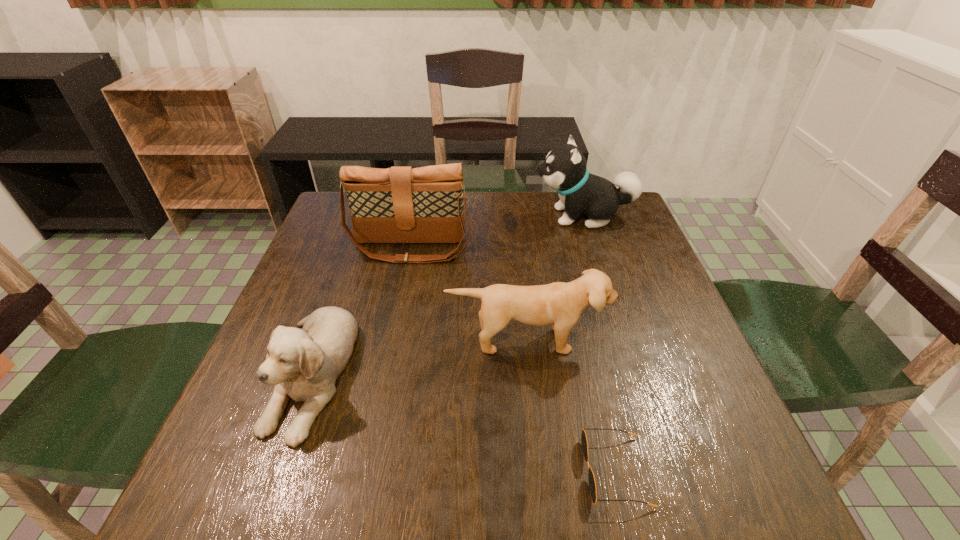
This screenshot has height=540, width=960. Identify the location of the farthest puppy. (565, 170).

This screenshot has height=540, width=960. I want to click on the tallest puppy, so click(565, 170).

You are a GUI agent. You are given a task and a screenshot of the screen. Output one action in this format:
    pyautogui.click(x=<x>, y=<y>)
    Task: Click on the shoulder bag
    
    Given the screenshot: What is the action you would take?
    pyautogui.click(x=401, y=204)

Identify the location of the leftmost puppy. The height and width of the screenshot is (540, 960). (303, 364).

This screenshot has width=960, height=540. I want to click on sunglasses, so click(x=592, y=485).

You are a GUI agent. You are given a task and a screenshot of the screen. Output one action in this format:
    pyautogui.click(x=<x>, y=<y>)
    Task: Click on the free space located 0.110m at the face of the farthest puppy
    The image size is (960, 540).
    Given the screenshot: What is the action you would take?
    pyautogui.click(x=495, y=216)

You are a GUI agent. You are given a task and a screenshot of the screen. Output one action in this format:
    pyautogui.click(x=<x>, y=<y>)
    Task: Click on the free location located at the face of the farthest puppy
    
    Given the screenshot: What is the action you would take?
    pyautogui.click(x=424, y=216)

Locate an element on the screen. This screenshot has height=540, width=960. vacant space located at the face of the farthest puppy is located at coordinates (468, 216).

Identify the location of free spot located 0.110m on the front-facing side of the fourth nearest object. (401, 294).

This screenshot has height=540, width=960. I want to click on free location located on the front-facing side of the leftmost puppy, so click(x=267, y=498).